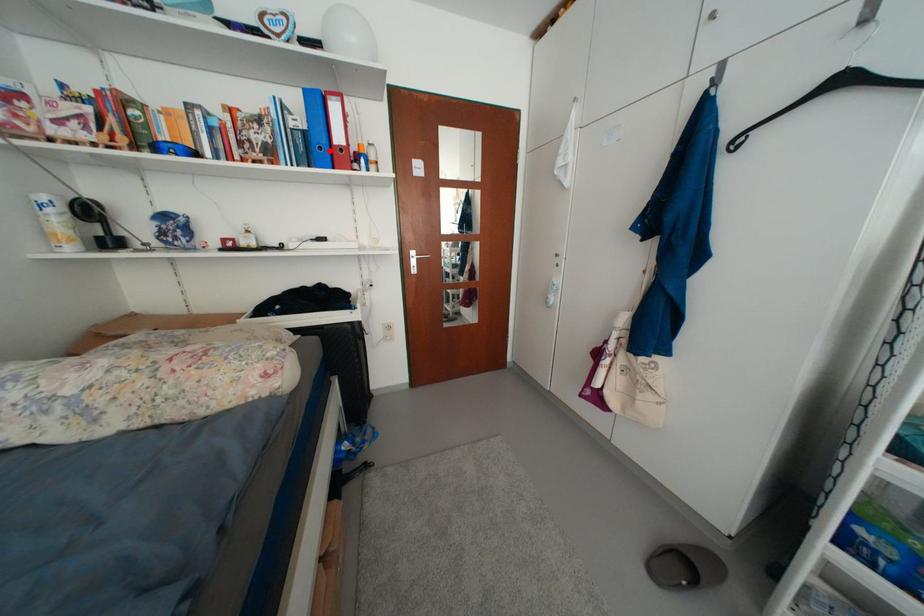
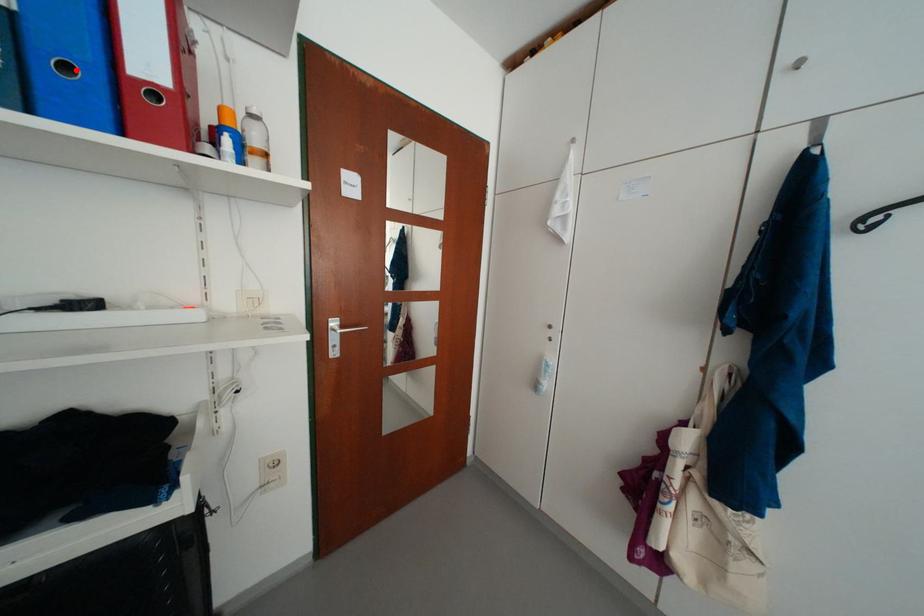
I am providing you with two images of the same scene from different viewpoints. A red point is marked on the first image and another point is marked on the second image. Do the highlighted points in image1 and image2 indicate the same real-world spot?

Yes